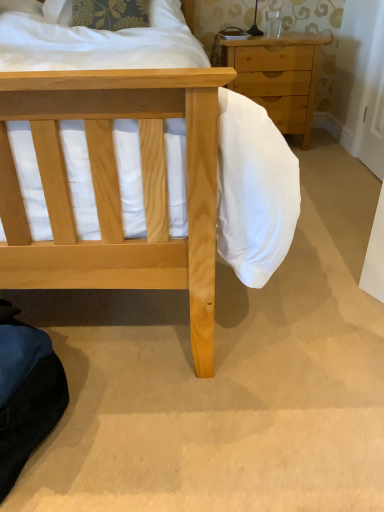
Where is `white fabric pillow at upper left`? The height and width of the screenshot is (512, 384). white fabric pillow at upper left is located at coordinates (110, 14).

What do you see at coordinates (110, 14) in the screenshot?
I see `white fabric pillow at upper left` at bounding box center [110, 14].

What do you see at coordinates (278, 76) in the screenshot?
I see `light wood/texture chest of drawers at upper right` at bounding box center [278, 76].

The height and width of the screenshot is (512, 384). I want to click on light wood/texture chest of drawers at upper right, so click(278, 76).

The height and width of the screenshot is (512, 384). Identify the location of white fabric pillow at upper left. (110, 14).

Considering the relative positions of white fabric pillow at upper left and light wood/texture chest of drawers at upper right in the image provided, is white fabric pillow at upper left to the left or to the right of light wood/texture chest of drawers at upper right?

white fabric pillow at upper left is positioned on light wood/texture chest of drawers at upper right's left side.

Is white fabric pillow at upper left positioned in front of light wood/texture chest of drawers at upper right?

Yes, it is in front of light wood/texture chest of drawers at upper right.

Which is nearer, (x=85, y=15) or (x=270, y=69)?

Point (x=85, y=15).

From the image's perspective, is white fabric pillow at upper left below light wood/texture chest of drawers at upper right?

No.

From a real-world perspective, which is physically above, white fabric pillow at upper left or light wood/texture chest of drawers at upper right?

In real-world perspective, white fabric pillow at upper left is above.

In the scene shown: Which object is wider, white fabric pillow at upper left or light wood/texture chest of drawers at upper right?

Wider between the two is light wood/texture chest of drawers at upper right.

From their relative heights in the image, would you say white fabric pillow at upper left is taller or shorter than light wood/texture chest of drawers at upper right?

In the image, white fabric pillow at upper left appears to be shorter than light wood/texture chest of drawers at upper right.

Which of these two, white fabric pillow at upper left or light wood/texture chest of drawers at upper right, is smaller?

white fabric pillow at upper left is smaller.

From the picture: Is light wood/texture chest of drawers at upper right a part of white fabric pillow at upper left?

Actually, light wood/texture chest of drawers at upper right is outside white fabric pillow at upper left.

Are white fabric pillow at upper left and light wood/texture chest of drawers at upper right far apart?

No.

Is white fabric pillow at upper left oriented away from light wood/texture chest of drawers at upper right?

No, white fabric pillow at upper left is not facing the opposite direction of light wood/texture chest of drawers at upper right.

How many degrees apart are the facing directions of white fabric pillow at upper left and light wood/texture chest of drawers at upper right?

9.56 degrees.

Looking at this image, measure the distance between white fabric pillow at upper left and light wood/texture chest of drawers at upper right.

white fabric pillow at upper left and light wood/texture chest of drawers at upper right are 72.36 centimeters apart from each other.

The width and height of the screenshot is (384, 512). In order to click on chest of drawers below the white fabric pillow at upper left (from the image's perspective) in this screenshot , I will do `click(278, 76)`.

Can you confirm if light wood/texture chest of drawers at upper right is positioned to the left of white fabric pillow at upper left?

No.

Does light wood/texture chest of drawers at upper right lie behind white fabric pillow at upper left?

Yes, light wood/texture chest of drawers at upper right is further from the camera.

Which is closer, [300,46] or [109,19]?

The point [109,19] is in front.

In the scene shown: From the image's perspective, between light wood/texture chest of drawers at upper right and white fabric pillow at upper left, which one is located above?

white fabric pillow at upper left appears higher in the image.

From a real-world perspective, between light wood/texture chest of drawers at upper right and white fabric pillow at upper left, who is vertically higher?

From a 3D spatial view, white fabric pillow at upper left is above.

Which object is thinner, light wood/texture chest of drawers at upper right or white fabric pillow at upper left?

white fabric pillow at upper left is thinner.

From the picture: Considering the sizes of objects light wood/texture chest of drawers at upper right and white fabric pillow at upper left in the image provided, who is taller, light wood/texture chest of drawers at upper right or white fabric pillow at upper left?

Standing taller between the two is light wood/texture chest of drawers at upper right.

Which of these two, light wood/texture chest of drawers at upper right or white fabric pillow at upper left, is smaller?

Smaller between the two is white fabric pillow at upper left.

Is light wood/texture chest of drawers at upper right situated inside white fabric pillow at upper left or outside?

light wood/texture chest of drawers at upper right exists outside the volume of white fabric pillow at upper left.

Is light wood/texture chest of drawers at upper right not near white fabric pillow at upper left?

light wood/texture chest of drawers at upper right is actually quite close to white fabric pillow at upper left.

Is white fabric pillow at upper left at the back of light wood/texture chest of drawers at upper right?

That's not correct — light wood/texture chest of drawers at upper right is not looking away from white fabric pillow at upper left.

There is a light wood/texture chest of drawers at upper right. Where is `pillow above it (from a real-world perspective)`? This screenshot has height=512, width=384. pillow above it (from a real-world perspective) is located at coordinates (110, 14).

Image resolution: width=384 pixels, height=512 pixels. In order to click on the chest of drawers lying below the white fabric pillow at upper left (from the image's perspective) in this screenshot , I will do click(x=278, y=76).

You are a GUI agent. You are given a task and a screenshot of the screen. Output one action in this format:
    pyautogui.click(x=<x>, y=<y>)
    Task: Click on the chest of drawers below the white fabric pillow at upper left (from a real-world perspective)
    The width and height of the screenshot is (384, 512).
    Given the screenshot: What is the action you would take?
    pyautogui.click(x=278, y=76)